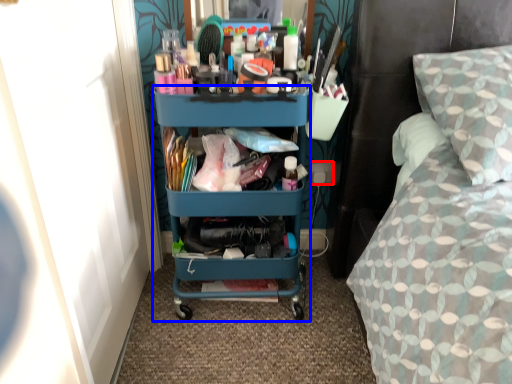
Question: Which object is closer to the camera taking this photo, power outlet (highlighted by a red box) or desk (highlighted by a blue box)?

Choices:
 (A) power outlet
 (B) desk

Answer: (B)